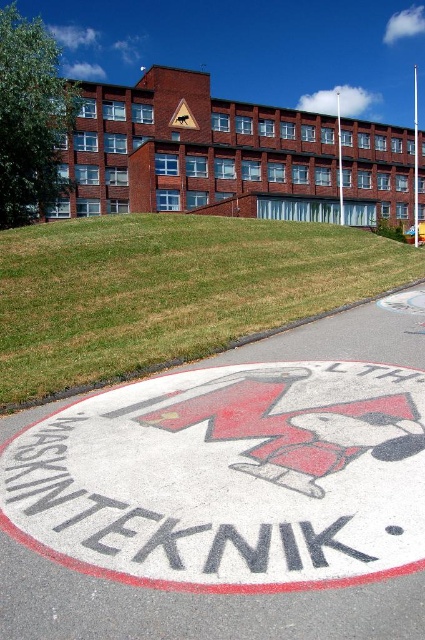
You are a delivery driver who needs to park your vehicle in the area shown. The parking space must be large enough to accommodate your truck, which is 3 meters wide. Based on the scene, can the white asphalt circle at center and the yellow plastic triangle at upper center accommodate your vehicle?

The white asphalt circle at center has a larger size compared to the yellow plastic triangle at upper center. Since the truck requires a 3 meter width, the white asphalt circle at center is more likely to accommodate the vehicle due to its larger size.

You are standing in front of the building and want to place a small flag exactly halfway between the white asphalt circle at center and the yellow plastic triangle at upper center. Which object will the flag be closer to?

The flag will be closer to the white asphalt circle at center because it is closer to the viewer than the yellow plastic triangle at upper center.

You are a delivery driver approaching the building and need to park your vehicle. You see the white asphalt circle at center and the yellow plastic triangle at upper center. Which parking area should you avoid to comply with the traffic regulations?

You should avoid parking on the white asphalt circle at center because it is below the yellow plastic triangle at upper center, indicating it might be a restricted or designated area.